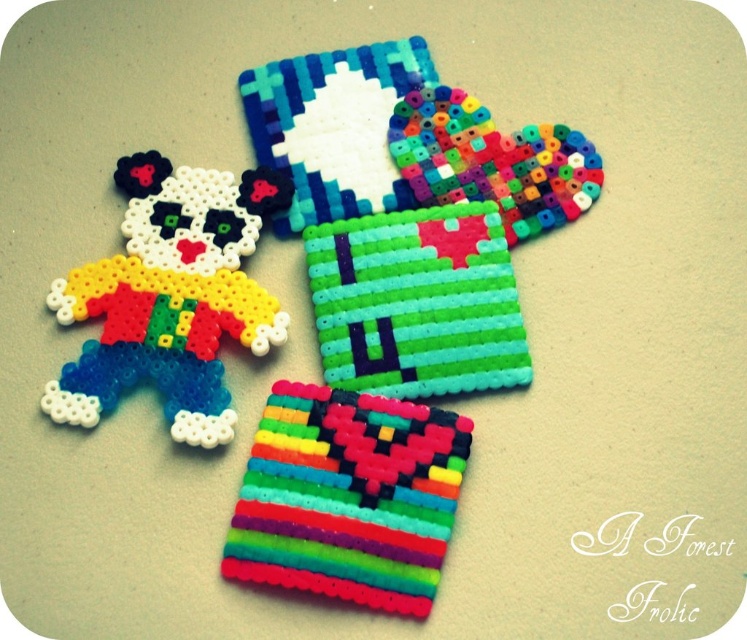
Question: Based on their relative distances, which object is nearer to the matte plastic clown at left?

Choices:
 (A) green matte pixelated square at center
 (B) multicolored beads at center

Answer: (A)

Question: Is rainbow plastic beads at center smaller than multicolored beads at center?

Choices:
 (A) yes
 (B) no

Answer: (B)

Question: Estimate the real-world distances between objects in this image. Which object is farther from the green matte pixelated square at center?

Choices:
 (A) multicolored beads at center
 (B) rainbow plastic beads at center
 (C) matte plastic clown at left

Answer: (C)

Question: Which of these objects is positioned closest to the rainbow plastic beads at center?

Choices:
 (A) multicolored beads at center
 (B) green matte pixelated square at center
 (C) matte plastic clown at left

Answer: (B)

Question: Can you confirm if rainbow plastic beads at center is bigger than multicolored beads at center?

Choices:
 (A) no
 (B) yes

Answer: (B)

Question: Where is green matte pixelated square at center located in relation to multicolored beads at center in the image?

Choices:
 (A) above
 (B) below

Answer: (B)